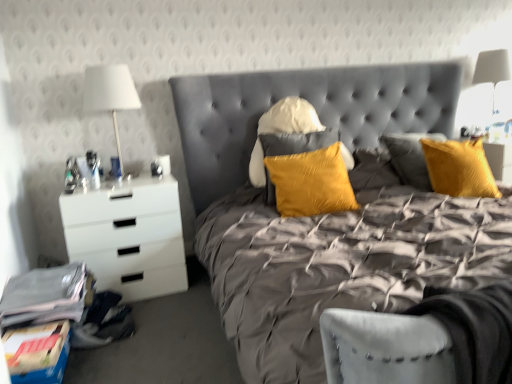
Question: Could you tell me if satin yellow pillow at center is facing white fabric lampshade at left, which is the 1th bedside lamp in left-to-right order?

Choices:
 (A) no
 (B) yes

Answer: (A)

Question: Would you say white fabric lampshade at left, which is counted as the second bedside lamp, starting from the right, is part of satin yellow pillow at center's contents?

Choices:
 (A) no
 (B) yes

Answer: (A)

Question: Does satin yellow pillow at center lie behind white fabric lampshade at left, which appears as the first bedside lamp when viewed from the front?

Choices:
 (A) yes
 (B) no

Answer: (B)

Question: Is satin yellow pillow at center facing away from white fabric lampshade at left, which appears as the first bedside lamp when viewed from the front?

Choices:
 (A) no
 (B) yes

Answer: (A)

Question: Is satin yellow pillow at center positioned in front of white fabric lampshade at left, the second bedside lamp viewed from the back?

Choices:
 (A) yes
 (B) no

Answer: (A)

Question: Does satin yellow pillow at center have a greater width compared to white fabric lampshade at left, which is the 1th bedside lamp in left-to-right order?

Choices:
 (A) no
 (B) yes

Answer: (A)

Question: Is velvet grey bed at center far from white fabric lampshade at left, which is the 1th bedside lamp in left-to-right order?

Choices:
 (A) yes
 (B) no

Answer: (A)

Question: From a real-world perspective, is velvet grey bed at center physically below white fabric lampshade at left, which is counted as the second bedside lamp, starting from the right?

Choices:
 (A) no
 (B) yes

Answer: (B)

Question: Can you confirm if velvet grey bed at center is taller than white fabric lampshade at left, which is counted as the second bedside lamp, starting from the right?

Choices:
 (A) no
 (B) yes

Answer: (B)

Question: Is velvet grey bed at center completely or partially outside of white fabric lampshade at left, which appears as the first bedside lamp when viewed from the front?

Choices:
 (A) no
 (B) yes

Answer: (B)

Question: Is velvet grey bed at center touching white fabric lampshade at left, which is the 1th bedside lamp in left-to-right order?

Choices:
 (A) yes
 (B) no

Answer: (B)

Question: Does velvet grey bed at center have a larger size compared to white fabric lampshade at left, which appears as the first bedside lamp when viewed from the front?

Choices:
 (A) no
 (B) yes

Answer: (B)

Question: Is white fabric lampshade at left, the second bedside lamp viewed from the back, not within satin yellow pillow at center?

Choices:
 (A) no
 (B) yes

Answer: (B)